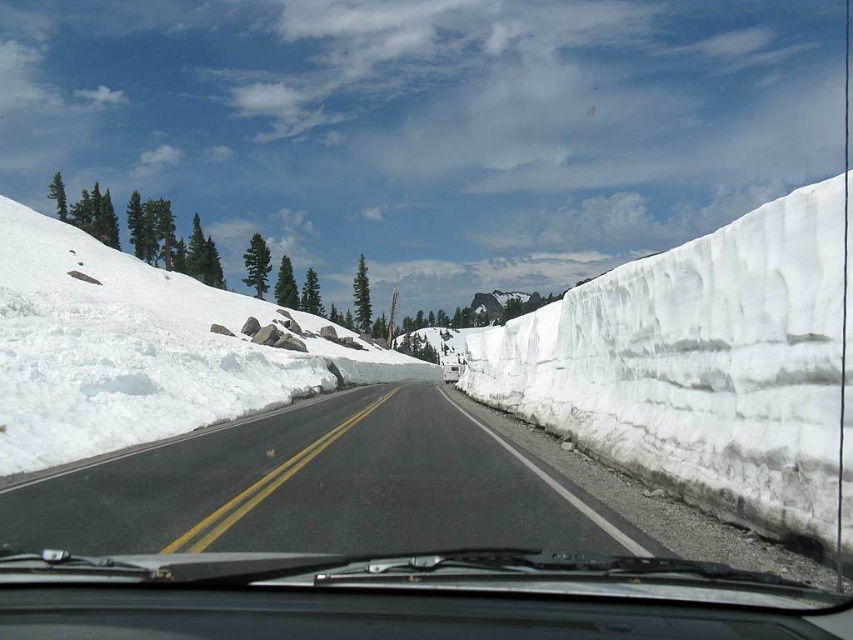
You are driving a car with a 5 meter long trailer attached. You need to make a U turn on the road shown in the image. Can you safely complete the U turn without crossing the double yellow line or hitting the snowbanks? The point at coordinate (x=410, y=545) is 129.88 meters away from the camera.

The point at coordinate (x=410, y=545) is 129.88 meters away from the camera, which indicates the distance available for the U turn. However, the road is flanked by towering snowbanks and marked with a double yellow line, suggesting limited space. A 5 meter trailer would require a turning radius larger than the available road width between the snowbanks. Therefore, it is not safe to make the U turn without risking contact with the snowbanks or crossing the double yellow line.

You are driving a car with a 120 meter long convoy behind you. You look out the windshield and see the black asphalt road at center. Can you safely let the convoy pass before the road curves to the right?

The black asphalt road at center and camera are 119.38 meters apart. Since the convoy is 120 meters long, it would not fit within the available space before the road curves to the right, so you cannot safely let the convoy pass.